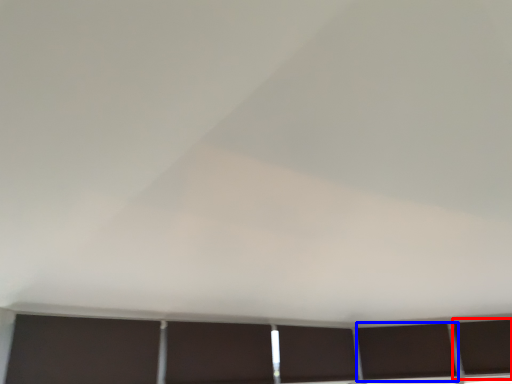
Question: Which object is closer to the camera taking this photo, window (highlighted by a red box) or window (highlighted by a blue box)?

Choices:
 (A) window
 (B) window

Answer: (A)